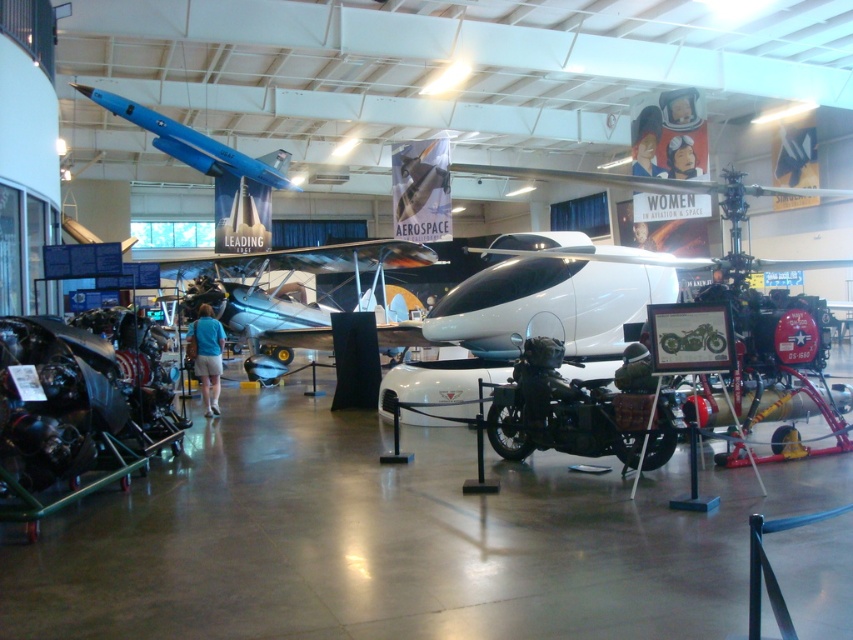
You are standing at the entrance of the museum and want to locate the silver metallic airplane at center. Which direction should you move to reach it?

You should move towards the center of the museum to reach the silver metallic airplane at center, as it is located at point (286,288).

You are a visitor in the museum and want to take a photo of both the shiny black motorcycle at center and the blue matte airplane at upper center. Which one do you need to stand closer to in order to capture both in a single frame?

The shiny black motorcycle at center is not as tall as the blue matte airplane at upper center, so you need to stand closer to the shiny black motorcycle at center to include both in the frame.

You are a visitor at the museum and want to take a photo of both the shiny black motorcycle at center and the silver metallic airplane at center. Since you want to include both in the same frame, will the motorcycle block the airplane from view?

The shiny black motorcycle at center is taller than the silver metallic airplane at center, so it might block the airplane from view if positioned in front. Ensure you position yourself or adjust the angle so that the motorcycle doesn not obscure the airplane.